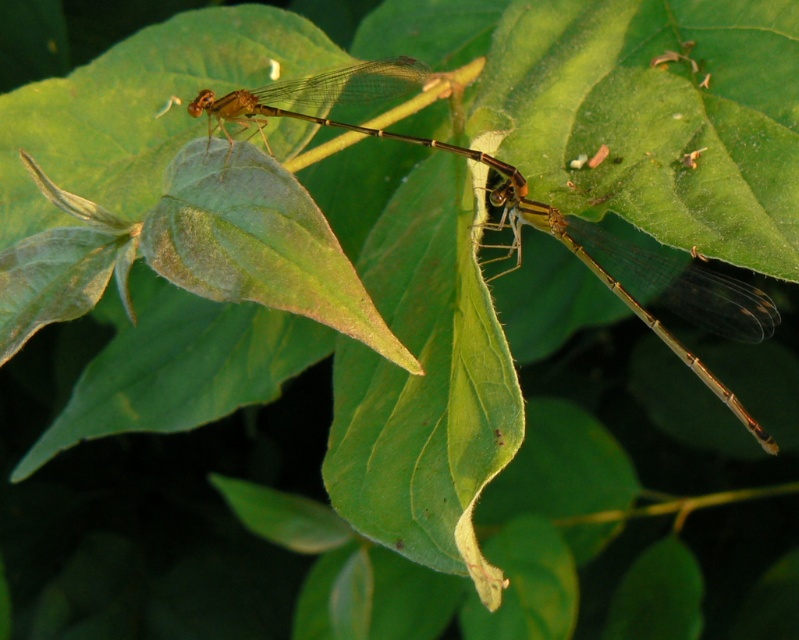
Question: Which point is closer to the camera?

Choices:
 (A) translucent amber dragonfly at upper center
 (B) translucent amber dragonfly at center

Answer: (B)

Question: Does translucent amber dragonfly at center have a smaller size compared to translucent amber dragonfly at upper center?

Choices:
 (A) no
 (B) yes

Answer: (A)

Question: Is translucent amber dragonfly at center thinner than translucent amber dragonfly at upper center?

Choices:
 (A) yes
 (B) no

Answer: (B)

Question: Is translucent amber dragonfly at center wider than translucent amber dragonfly at upper center?

Choices:
 (A) yes
 (B) no

Answer: (A)

Question: Which point is closer to the camera?

Choices:
 (A) translucent amber dragonfly at center
 (B) translucent amber dragonfly at upper center

Answer: (A)